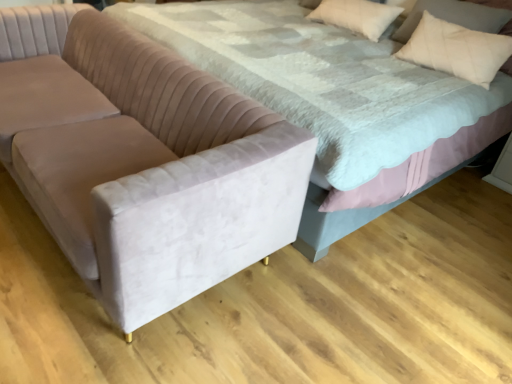
The height and width of the screenshot is (384, 512). What do you see at coordinates (456, 49) in the screenshot? I see `beige cotton pillow at upper right` at bounding box center [456, 49].

Describe the element at coordinates (357, 16) in the screenshot. This screenshot has height=384, width=512. I see `white soft pillow at upper right` at that location.

The image size is (512, 384). Identify the location of velvet bed at center. (343, 97).

What do you see at coordinates (343, 97) in the screenshot?
I see `velvet bed at center` at bounding box center [343, 97].

Image resolution: width=512 pixels, height=384 pixels. What do you see at coordinates (142, 160) in the screenshot? I see `velvet couch at left` at bounding box center [142, 160].

Locate an element on the screen. beige cotton pillow at upper right is located at coordinates (456, 49).

Based on the photo, in terms of height, does velvet bed at center look taller or shorter compared to white soft pillow at upper right?

Considering their sizes, velvet bed at center has more height than white soft pillow at upper right.

Does velvet bed at center turn towards white soft pillow at upper right?

Yes, velvet bed at center faces towards white soft pillow at upper right.

Who is bigger, velvet bed at center or white soft pillow at upper right?

Bigger between the two is velvet bed at center.

How distant is velvet bed at center from white soft pillow at upper right?

velvet bed at center is 28.67 inches away from white soft pillow at upper right.

Can you confirm if velvet couch at left is bigger than white soft pillow at upper right?

Correct, velvet couch at left is larger in size than white soft pillow at upper right.

Based on their positions, is velvet couch at left located to the left or right of white soft pillow at upper right?

Based on their positions, velvet couch at left is located to the left of white soft pillow at upper right.

Does velvet couch at left contain white soft pillow at upper right?

Definitely not — white soft pillow at upper right is not inside velvet couch at left.

Can you confirm if white soft pillow at upper right is thinner than velvet couch at left?

Indeed, white soft pillow at upper right has a lesser width compared to velvet couch at left.

Can you tell me how much white soft pillow at upper right and velvet couch at left differ in facing direction?

7.46 degrees.

Is white soft pillow at upper right positioned in front of velvet couch at left?

That is False.

From the image's perspective, which one is positioned lower, white soft pillow at upper right or velvet couch at left?

velvet couch at left.

From a real-world perspective, is white soft pillow at upper right below velvet bed at center?

No.

Considering the points (351, 17) and (434, 142), which point is behind, point (351, 17) or point (434, 142)?

The point (351, 17) is more distant.

From the picture: Could velvet bed at center be considered to be inside white soft pillow at upper right?

Actually, velvet bed at center is outside white soft pillow at upper right.

Considering the relative positions of velvet bed at center and velvet couch at left in the image provided, is velvet bed at center to the left or to the right of velvet couch at left?

In the image, velvet bed at center appears on the right side of velvet couch at left.

Is velvet bed at center wider or thinner than velvet couch at left?

Clearly, velvet bed at center has more width compared to velvet couch at left.

From a real-world perspective, which is physically below, velvet bed at center or velvet couch at left?

velvet couch at left.

From the image's perspective, is velvet bed at center under velvet couch at left?

No, from the image's perspective, velvet bed at center is not below velvet couch at left.

Can you see beige cotton pillow at upper right touching velvet couch at left?

No.

Is beige cotton pillow at upper right not within velvet couch at left?

beige cotton pillow at upper right lies outside velvet couch at left's area.

From the image's perspective, which one is positioned higher, beige cotton pillow at upper right or velvet couch at left?

beige cotton pillow at upper right.

In the image, is beige cotton pillow at upper right positioned in front of or behind velvet couch at left?

beige cotton pillow at upper right is behind velvet couch at left.

Looking at this image, measure the distance between velvet bed at center and beige cotton pillow at upper right.

They are 21.13 inches apart.

Is velvet bed at center taller or shorter than beige cotton pillow at upper right?

In the image, velvet bed at center appears to be taller than beige cotton pillow at upper right.

In the scene shown: From the image's perspective, which one is positioned higher, velvet bed at center or beige cotton pillow at upper right?

beige cotton pillow at upper right.

Is velvet bed at center positioned with its back to beige cotton pillow at upper right?

That's right, velvet bed at center is facing away from beige cotton pillow at upper right.

This screenshot has height=384, width=512. In order to click on pillow that is on the right side of velvet bed at center in this screenshot , I will do [x=357, y=16].

There is a velvet couch at left. At what (x,y) coordinates should I click in order to perform the action: click on pillow above it (from a real-world perspective). Please return your answer as a coordinate pair (x, y). Looking at the image, I should click on pos(357,16).

Estimate the real-world distances between objects in this image. Which object is further from velvet bed at center, velvet couch at left or beige cotton pillow at upper right?

velvet couch at left.

Based on their spatial positions, is velvet bed at center or velvet couch at left closer to beige cotton pillow at upper right?

Based on the image, velvet bed at center appears to be nearer to beige cotton pillow at upper right.

Looking at the image, which one is located further to velvet bed at center, velvet couch at left or white soft pillow at upper right?

The object further to velvet bed at center is white soft pillow at upper right.

From the image, which object appears to be nearer to velvet couch at left, beige cotton pillow at upper right or white soft pillow at upper right?

beige cotton pillow at upper right.

Considering their positions, is velvet bed at center positioned further to beige cotton pillow at upper right than white soft pillow at upper right?

Among the two, velvet bed at center is located further to beige cotton pillow at upper right.

Looking at this image, when comparing their distances from velvet couch at left, does white soft pillow at upper right or beige cotton pillow at upper right seem closer?

beige cotton pillow at upper right lies closer to velvet couch at left than the other object.

Looking at the image, which one is located further to white soft pillow at upper right, beige cotton pillow at upper right or velvet couch at left?

Among the two, velvet couch at left is located further to white soft pillow at upper right.

Looking at the image, which one is located further to white soft pillow at upper right, velvet couch at left or velvet bed at center?

The object further to white soft pillow at upper right is velvet couch at left.

Locate an element on the screen. Image resolution: width=512 pixels, height=384 pixels. bed between velvet couch at left and white soft pillow at upper right from front to back is located at coordinates (343, 97).

Locate an element on the screen. throw pillow between velvet bed at center and white soft pillow at upper right along the z-axis is located at coordinates (456, 49).

You are a GUI agent. You are given a task and a screenshot of the screen. Output one action in this format:
    pyautogui.click(x=<x>, y=<y>)
    Task: Click on the pillow between velvet couch at left and beige cotton pillow at upper right from left to right
    The width and height of the screenshot is (512, 384).
    Given the screenshot: What is the action you would take?
    pyautogui.click(x=357, y=16)

Where is `bed located between velvet couch at left and beige cotton pillow at upper right in the left-right direction`? This screenshot has height=384, width=512. bed located between velvet couch at left and beige cotton pillow at upper right in the left-right direction is located at coordinates (343, 97).